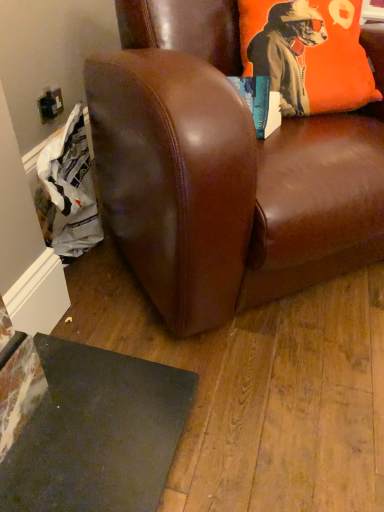
Question: Considering the positions of point (357, 66) and point (114, 179), is point (357, 66) closer or farther from the camera than point (114, 179)?

Choices:
 (A) closer
 (B) farther

Answer: (B)

Question: Do you think orange fabric pillow at upper right is within brown leather chair at center, or outside of it?

Choices:
 (A) outside
 (B) inside

Answer: (B)

Question: Based on their sizes in the image, would you say orange fabric pillow at upper right is bigger or smaller than brown leather chair at center?

Choices:
 (A) big
 (B) small

Answer: (B)

Question: Is point (180, 18) positioned closer to the camera than point (359, 57)?

Choices:
 (A) closer
 (B) farther

Answer: (B)

Question: Is brown leather chair at center wider or thinner than orange fabric pillow at upper right?

Choices:
 (A) wide
 (B) thin

Answer: (A)

Question: Is brown leather chair at center taller or shorter than orange fabric pillow at upper right?

Choices:
 (A) short
 (B) tall

Answer: (B)

Question: From the image's perspective, is brown leather chair at center positioned above or below orange fabric pillow at upper right?

Choices:
 (A) above
 (B) below

Answer: (B)